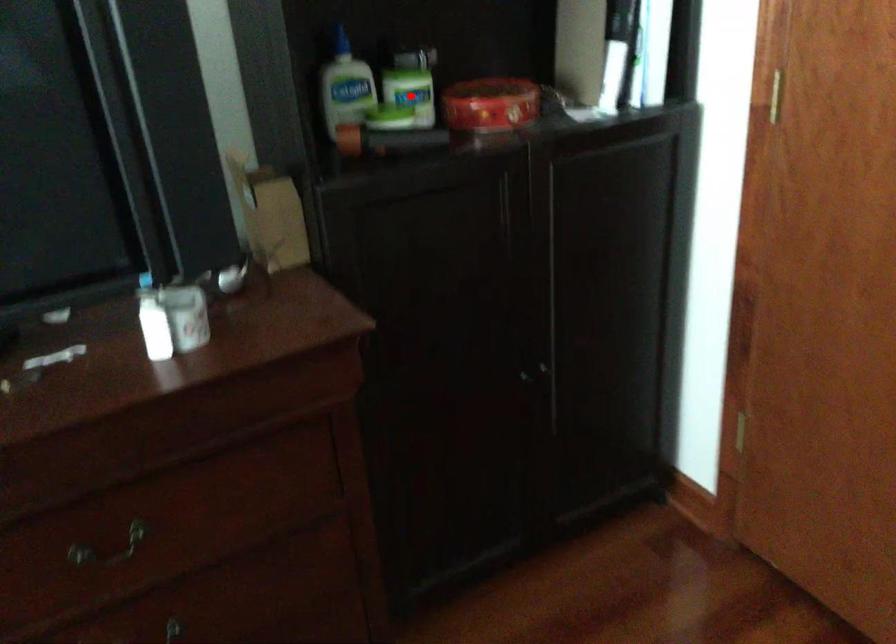
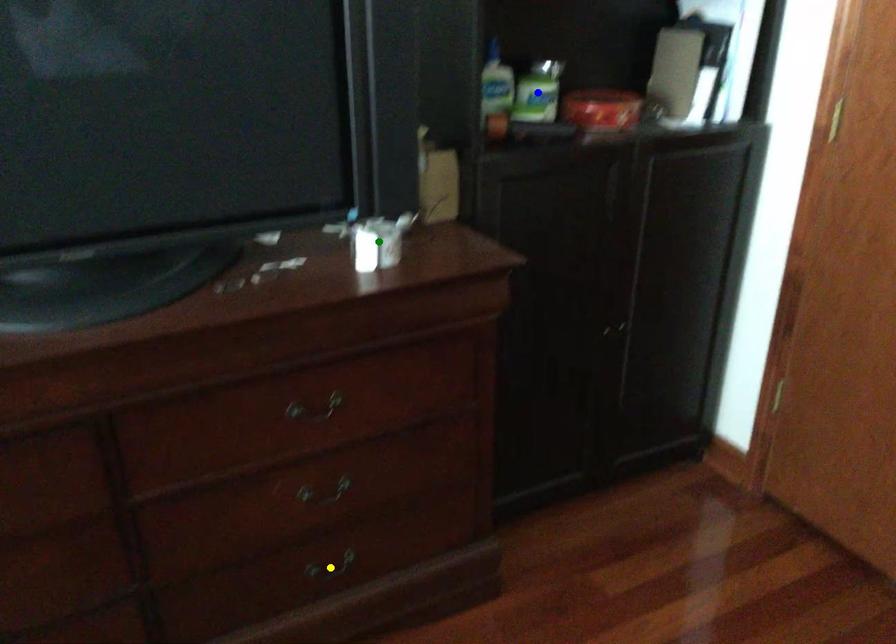
Question: I am providing you with two images of the same scene from different viewpoints. A red point is marked on the first image. You are given multiple points on the second image. Which spot in image 2 lines up with the point in image 1?

Choices:
 (A) yellow point
 (B) blue point
 (C) green point

Answer: (B)